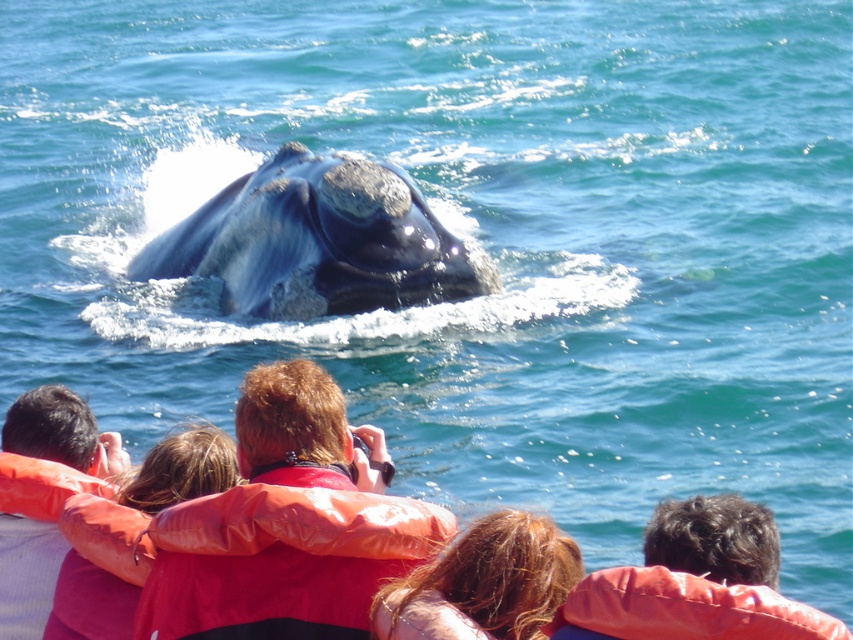
You are a photographer trying to capture the whale in the center of your photo. You notice the red leather jacket at center and the orange life jacket at lower left might block your view. Which object is bigger and might block more of the scene?

The red leather jacket at center is larger in size than the orange life jacket at lower left, so it might block more of the scene.

Consider the image. You are a photographer trying to capture a clear photo of the gray matte whale at center and the blonde hair at center. Which one should you focus on first if you want to ensure both are in focus, considering their sizes?

The gray matte whale at center is larger than the blonde hair at center, so you should focus on the gray matte whale at center first to ensure both are in focus.

Consider the image. You are a photographer positioned at the back of the group. You want to take a photo of the orange life jacket at lower left without the red leather jacket at center blocking it. Is this possible?

The red leather jacket at center is further to the viewer than the orange life jacket at lower left, so it is blocking the orange life jacket at lower left. Therefore, you cannot take a photo of the orange life jacket at lower left without the red leather jacket at center blocking it.